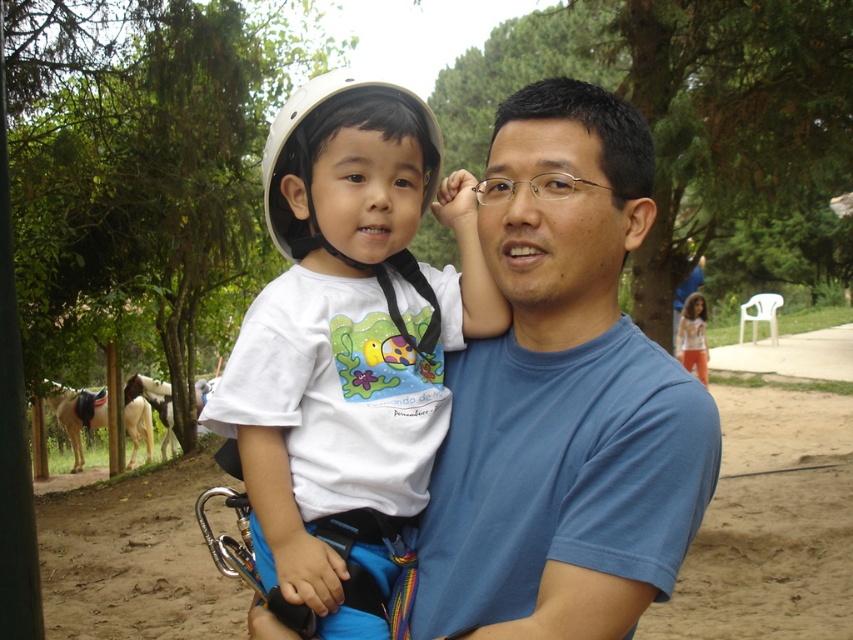
Is point (409, 189) farther from viewer compared to point (279, 122)?

Yes.

Between white matte helmet at upper left and white matte helmet at upper center, which one is positioned lower?

white matte helmet at upper left is below.

Between point (227, 381) and point (428, 125), which one is positioned behind?

The point (428, 125) is behind.

The width and height of the screenshot is (853, 640). Identify the location of white matte helmet at upper left. (349, 340).

Is point (334, 88) more distant than point (698, 362)?

No, it is in front of (698, 362).

Measure the distance from white matte helmet at upper center to white cotton shirt at center.

12.91 meters

In order to click on white matte helmet at upper center in this screenshot , I will do `click(306, 113)`.

The width and height of the screenshot is (853, 640). I want to click on white matte helmet at upper center, so 306,113.

Between blue cotton shirt at center and white matte helmet at upper left, which one has more height?

white matte helmet at upper left is taller.

Is blue cotton shirt at center behind white matte helmet at upper left?

No.

Is point (543, 614) farther from camera compared to point (357, 282)?

No.

Locate an element on the screen. blue cotton shirt at center is located at coordinates 563,396.